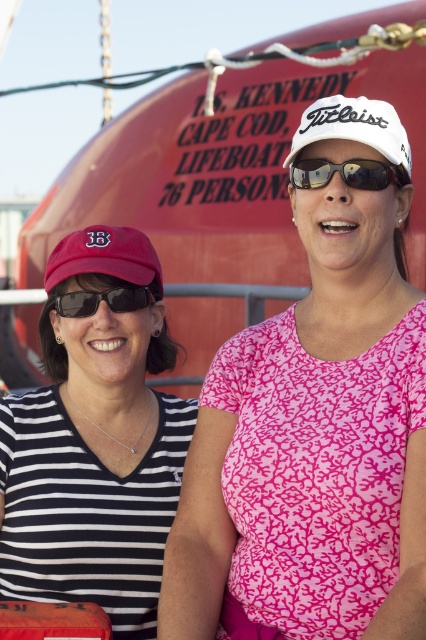
What object is located at the coordinates point (106, 257)?

The object at point (106, 257) is the matte red baseball cap at left.

You are a photographer trying to capture a clear shot of both the matte red baseball cap at left and the white matte baseball cap at upper center. Which cap should you focus on first to ensure it appears sharp in your photo?

You should focus on the matte red baseball cap at left first because it is closer to you than the white matte baseball cap at upper center, ensuring it stays sharp in the photo.

Based on the scene description, where is the matte red baseball cap at left located in terms of coordinates?

The matte red baseball cap at left is located at coordinates point (x=106, y=257).